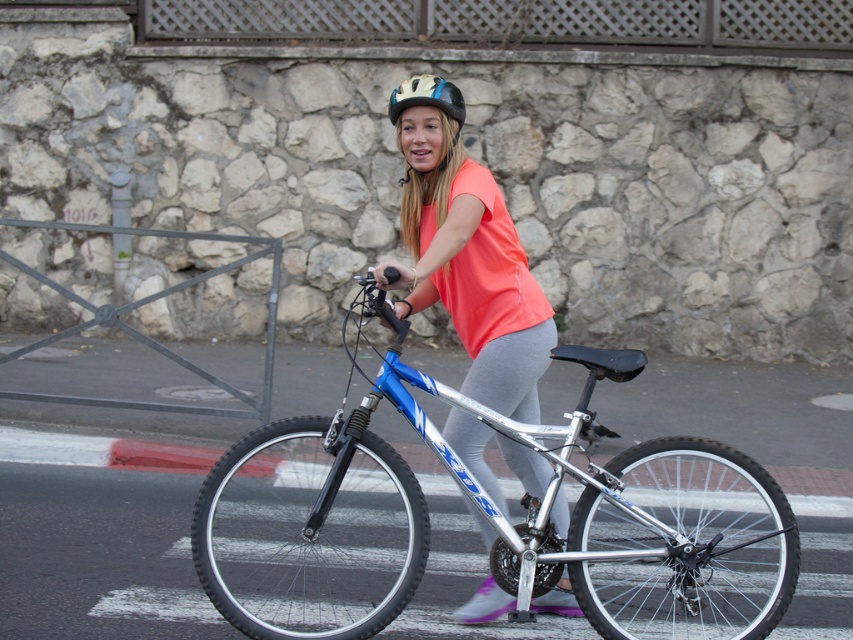
Question: Which point is closer to the camera taking this photo?

Choices:
 (A) (521, 337)
 (B) (727, 579)

Answer: (A)

Question: Does silver metallic bicycle at center lie behind matte yellow helmet at center?

Choices:
 (A) yes
 (B) no

Answer: (B)

Question: Can you confirm if silver metallic bicycle at center is thinner than matte yellow helmet at center?

Choices:
 (A) yes
 (B) no

Answer: (B)

Question: Is silver metallic bicycle at center below matte orange shirt at center?

Choices:
 (A) no
 (B) yes

Answer: (B)

Question: Which of the following is the closest to the observer?

Choices:
 (A) silver metallic bicycle at center
 (B) matte orange shirt at center
 (C) matte yellow helmet at center

Answer: (A)

Question: Among these objects, which one is farthest from the camera?

Choices:
 (A) silver metallic bicycle at center
 (B) matte orange shirt at center
 (C) matte yellow helmet at center

Answer: (C)